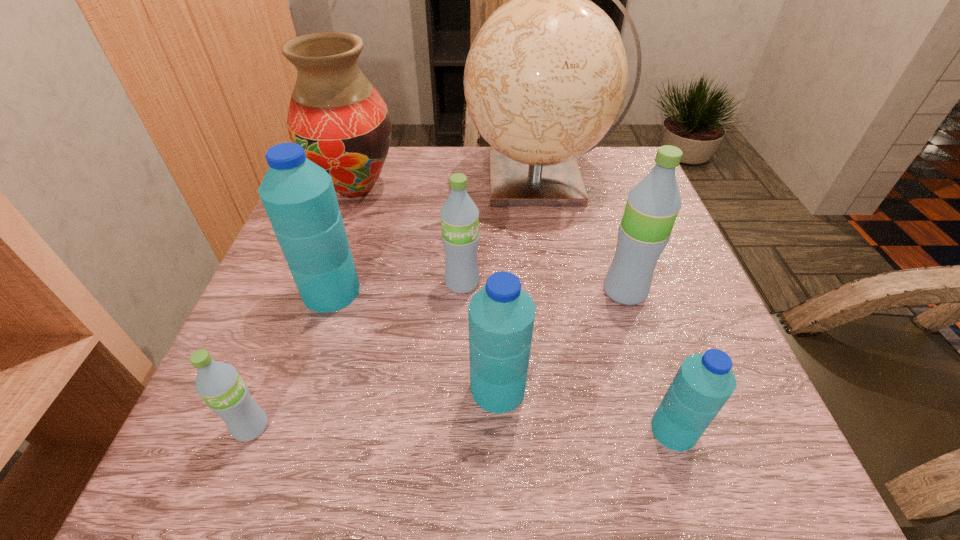
The height and width of the screenshot is (540, 960). Identify the location of vacant space in between the rightmost green water bottle and the leftmost blue water bottle. (478, 292).

Find the location of a particular element. The image size is (960, 540). unoccupied position between the rightmost blue water bottle and the second blue water bottle from right to left is located at coordinates (586, 409).

What are the coordinates of `object that ranks as the fourth closest to the vase` in the screenshot? It's located at (501, 315).

You are a GUI agent. You are given a task and a screenshot of the screen. Output one action in this format:
    pyautogui.click(x=<x>, y=<y>)
    Task: Click on the object that is the closest to the second blue water bottle from right to left
    This screenshot has width=960, height=540.
    Given the screenshot: What is the action you would take?
    pyautogui.click(x=459, y=215)

The image size is (960, 540). What are the coordinates of `water bottle that is the second closest to the biggest green water bottle` in the screenshot? It's located at coord(501,315).

Locate which water bottle is the fifth closest to the smallest green water bottle. Please provide its 2D coordinates. Your answer should be formatted as a tuple, i.e. [(x, y)], where the tuple contains the x and y coordinates of a point satisfying the conditions above.

[(652, 206)]

The width and height of the screenshot is (960, 540). Find the location of `green water bottle identified as the second closest to the rightmost blue water bottle`. green water bottle identified as the second closest to the rightmost blue water bottle is located at coordinates (459, 215).

Choose which green water bottle is the third nearest neighbor to the globe. Please provide its 2D coordinates. Your answer should be formatted as a tuple, i.e. [(x, y)], where the tuple contains the x and y coordinates of a point satisfying the conditions above.

[(219, 384)]

Find the location of a particular element. This screenshot has width=960, height=540. blue water bottle that is the second nearest to the leftmost green water bottle is located at coordinates (501, 315).

At what (x,y) coordinates should I click in order to perform the action: click on the second closest blue water bottle relative to the vase. Please return your answer as a coordinate pair (x, y). Looking at the image, I should click on tap(501, 315).